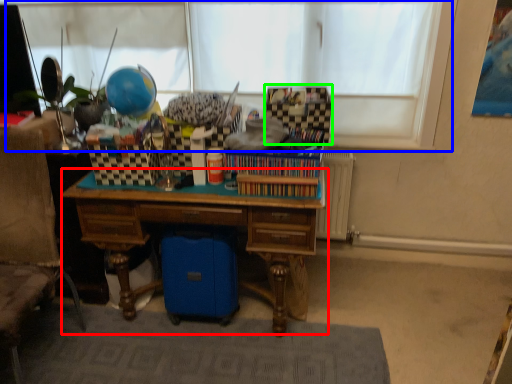
Question: Which object is the farthest from desk (highlighted by a red box)? Choose among these: window screen (highlighted by a blue box) or storage box (highlighted by a green box).

Choices:
 (A) window screen
 (B) storage box

Answer: (A)